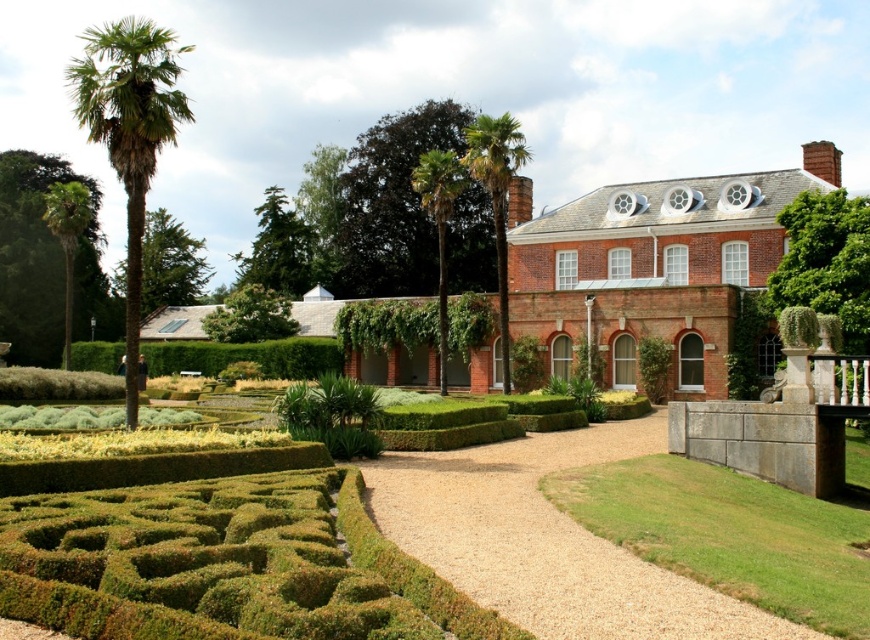
Question: Which object is farther from the camera taking this photo?

Choices:
 (A) green leafy palm at left
 (B) gravel at center
 (C) green leafy hedge at center

Answer: (C)

Question: Does green leafy hedge at center appear over green leafy palm tree at center?

Choices:
 (A) yes
 (B) no

Answer: (B)

Question: Can you confirm if green leafy palm tree at center is positioned above green leafy palm tree at left?

Choices:
 (A) yes
 (B) no

Answer: (A)

Question: Does gravel at center have a smaller size compared to green leafy hedge at center?

Choices:
 (A) yes
 (B) no

Answer: (A)

Question: Which object is positioned closest to the gravel at center?

Choices:
 (A) green leafy palm tree at left
 (B) green leafy palm at center

Answer: (B)

Question: Which object is positioned closest to the green leafy hedge at center?

Choices:
 (A) green leafy palm tree at center
 (B) green leafy palm at center
 (C) green leafy palm tree at left
 (D) gravel at center

Answer: (C)